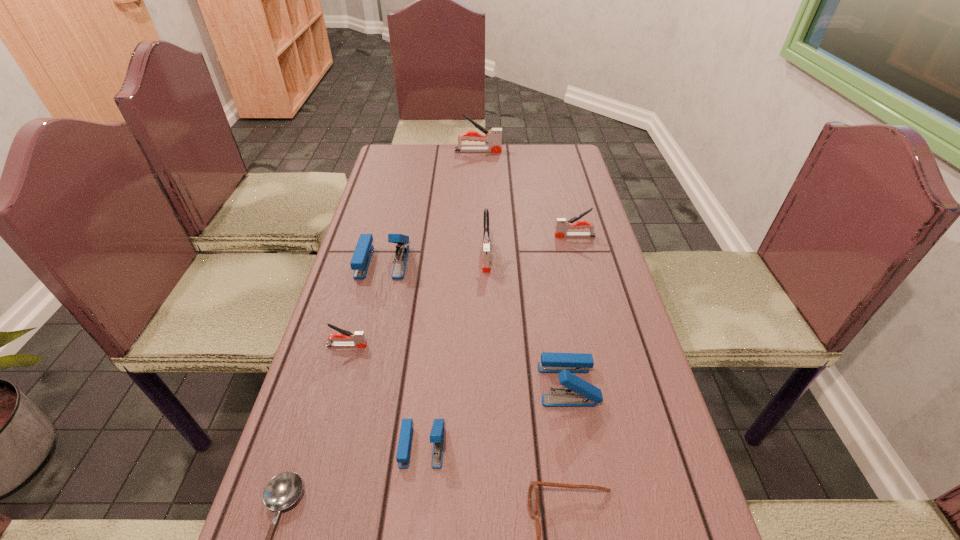
Identify the location of unoccupied position between the smallest gray stapler and the smallest blue stapler. (385, 395).

At what (x,y) coordinates should I click in order to perform the action: click on free spot between the farthest blue stapler and the third nearest object. Please return your answer as a coordinate pair (x, y). This screenshot has height=540, width=960. Looking at the image, I should click on (402, 354).

Identify the location of free space between the biggest blue stapler and the smallest gray stapler. (365, 303).

Select which object appears as the second closest to the leftmost blue stapler. Please provide its 2D coordinates. Your answer should be formatted as a tuple, i.e. [(x, y)], where the tuple contains the x and y coordinates of a point satisfying the conditions above.

[(358, 337)]

This screenshot has width=960, height=540. I want to click on object that stands as the second closest to the ladle, so click(x=358, y=337).

Image resolution: width=960 pixels, height=540 pixels. Identify the location of the sixth closest stapler to the second nearest gray stapler. click(494, 136).

Identify which stapler is the fifth closest to the rightmost gray stapler. Please provide its 2D coordinates. Your answer should be formatted as a tuple, i.e. [(x, y)], where the tuple contains the x and y coordinates of a point satisfying the conditions above.

[(358, 337)]

This screenshot has height=540, width=960. What are the coordinates of `gray stapler that is the second closest to the leftmost blue stapler` in the screenshot? It's located at (358, 337).

Point out which gray stapler is positioned as the second nearest to the third farthest gray stapler. Please provide its 2D coordinates. Your answer should be formatted as a tuple, i.e. [(x, y)], where the tuple contains the x and y coordinates of a point satisfying the conditions above.

[(358, 337)]

At what (x,y) coordinates should I click in order to perform the action: click on blue stapler that is the second closest one to the tallest stapler. Please return your answer as a coordinate pair (x, y). Looking at the image, I should click on click(x=579, y=393).